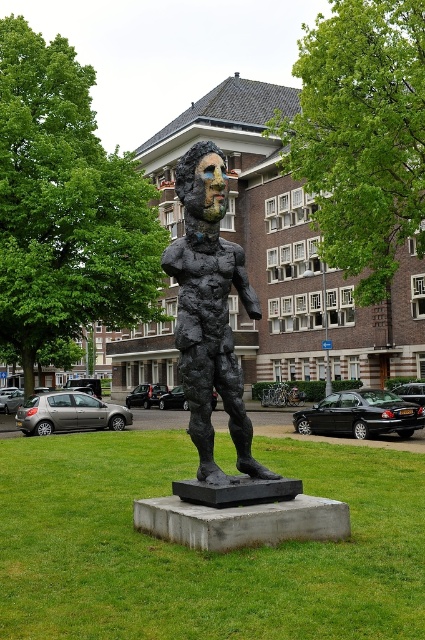
You are an art student observing the sculpture in the park. You notice two parts of the sculpture labeled as the black stone statue at center and the bronze textured figure at center. Which part is located above the other?

The bronze textured figure at center is above the black stone statue at center because the black stone statue at center is positioned under the bronze textured figure at center.